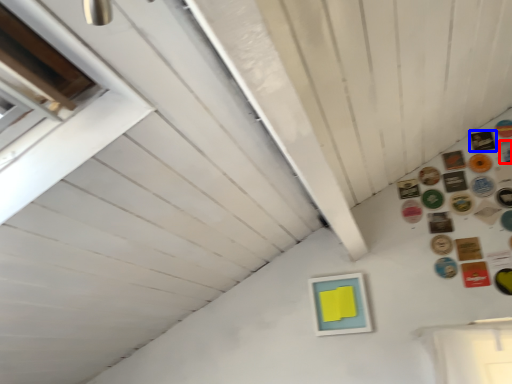
Question: Which point is closer to the camera, button (highlighted by a red box) or button (highlighted by a blue box)?

Choices:
 (A) button
 (B) button

Answer: (A)